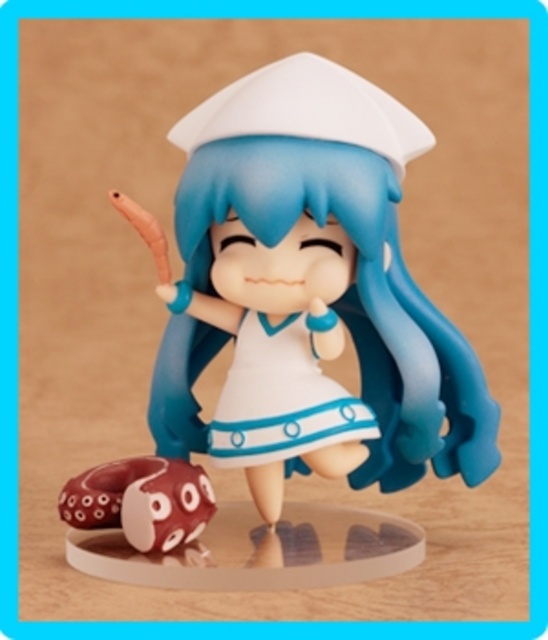
Does white glossy dress at center appear on the left side of matte brown octopus at lower left?

Incorrect, white glossy dress at center is not on the left side of matte brown octopus at lower left.

Is point (220, 396) less distant than point (174, 481)?

No, (220, 396) is further to viewer.

The height and width of the screenshot is (640, 548). In order to click on white glossy dress at center in this screenshot , I will do `click(281, 397)`.

Can you confirm if matte plastic figure at center is wider than white glossy dress at center?

Indeed, matte plastic figure at center has a greater width compared to white glossy dress at center.

Measure the distance between matte plastic figure at center and camera.

34.03 inches

Is point (214, 180) positioned in front of point (315, 426)?

Yes, point (214, 180) is closer to viewer.

Locate an element on the screen. This screenshot has width=548, height=640. matte plastic figure at center is located at coordinates (310, 292).

Between matte plastic figure at center and matte brown octopus at lower left, which one has more height?

matte plastic figure at center is taller.

Is matte plastic figure at center thinner than matte brown octopus at lower left?

In fact, matte plastic figure at center might be wider than matte brown octopus at lower left.

The width and height of the screenshot is (548, 640). Identify the location of matte plastic figure at center. (310, 292).